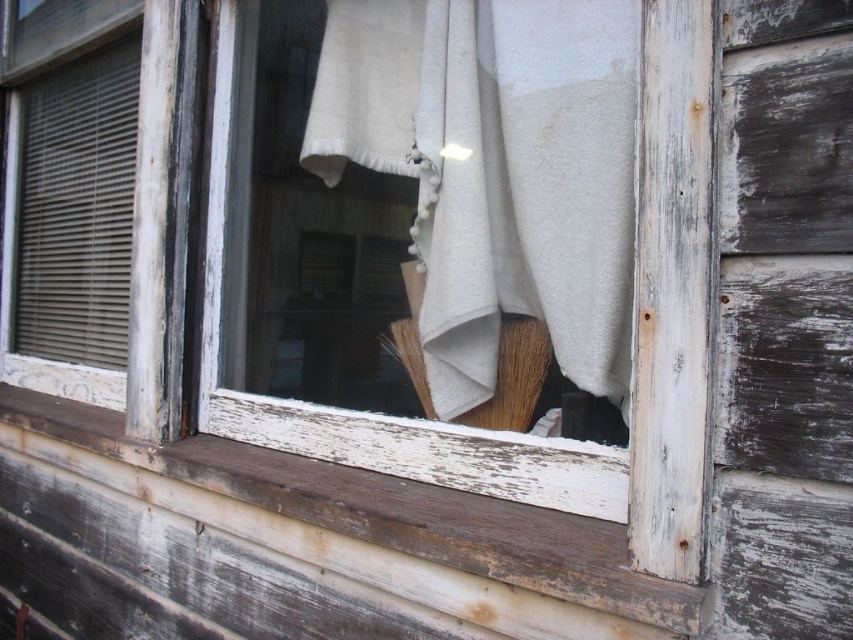
Between point (332, 515) and point (494, 388), which one is positioned behind?

Point (494, 388)

Who is more distant from viewer, (354, 518) or (515, 326)?

The point (515, 326) is behind.

Where is `weathered wood at lower center`? Image resolution: width=853 pixels, height=640 pixels. weathered wood at lower center is located at coordinates (393, 513).

Can you confirm if white cotton cloth at center is bigger than weathered wood at lower center?

No, white cotton cloth at center is not bigger than weathered wood at lower center.

Can you confirm if white cotton cloth at center is smaller than weathered wood at lower center?

Yes, white cotton cloth at center is smaller than weathered wood at lower center.

Find the location of a particular element. The width and height of the screenshot is (853, 640). white cotton cloth at center is located at coordinates (527, 188).

Does white cotton cloth at center have a smaller size compared to brown bristle brush at center?

No.

Locate an element on the screen. Image resolution: width=853 pixels, height=640 pixels. white cotton cloth at center is located at coordinates (527, 188).

I want to click on white cotton cloth at center, so click(x=527, y=188).